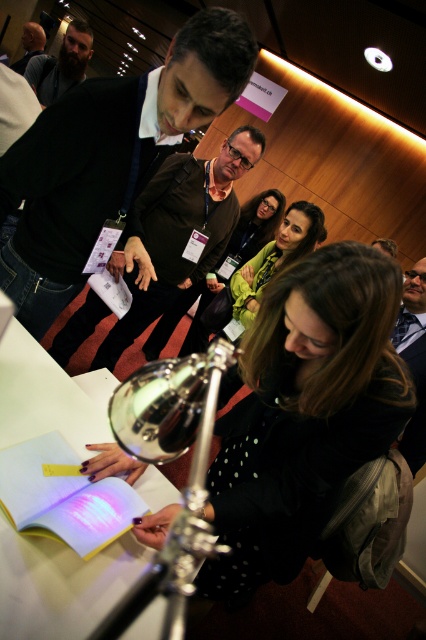
You are an attendee at the presentation and need to see both the white paper at center and the green matte jacket at center. Which one is closer to you?

The white paper at center is closer to you because it is in front of the green matte jacket at center.

You are organizing a display and need to place the white paper at center and the green matte jacket at center side by side on a shelf. Based on their sizes, which object should be placed first to ensure they fit properly?

The white paper at center has a lesser width compared to green matte jacket at center, so you should place the green matte jacket at center first on the shelf to accommodate its larger size before placing the white paper at center.

You are standing in the conference room and see two points marked on the wall. The first point is at coordinate point (385, 337) and the second is at point (88, 189). Which point is closer to you?

Point (385, 337) is closer to the viewer than point (88, 189).